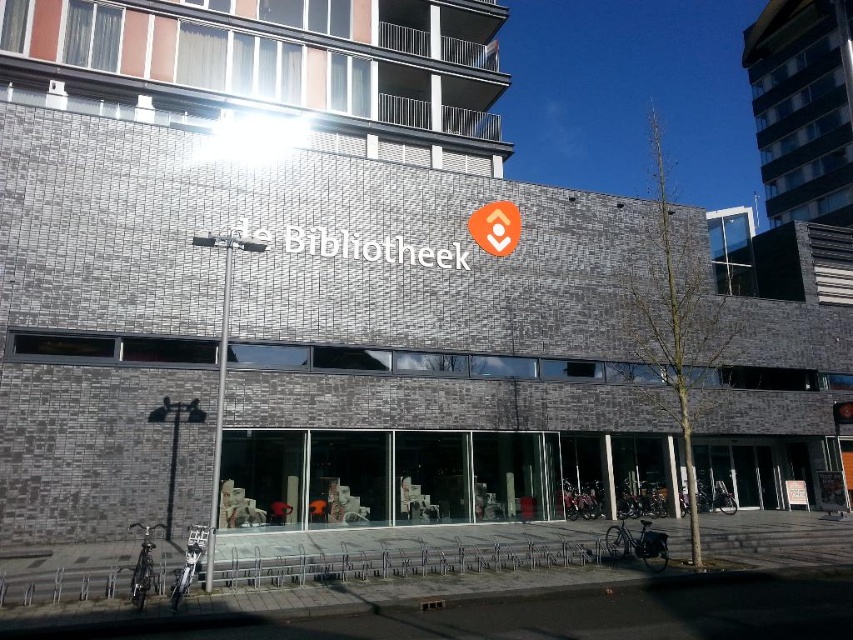
Question: Which object is closer to the camera taking this photo?

Choices:
 (A) orange fabric sign at center
 (B) metallic silver street sign at center

Answer: (B)

Question: Does metallic silver street sign at center have a greater width compared to orange fabric sign at center?

Choices:
 (A) yes
 (B) no

Answer: (B)

Question: Which point is farther from the camera taking this photo?

Choices:
 (A) (216, 448)
 (B) (474, 230)

Answer: (B)

Question: Is metallic silver street sign at center in front of orange fabric sign at center?

Choices:
 (A) yes
 (B) no

Answer: (A)

Question: Is metallic silver street sign at center above orange fabric sign at center?

Choices:
 (A) no
 (B) yes

Answer: (A)

Question: Among these points, which one is nearest to the camera?

Choices:
 (A) (512, 212)
 (B) (216, 506)

Answer: (B)